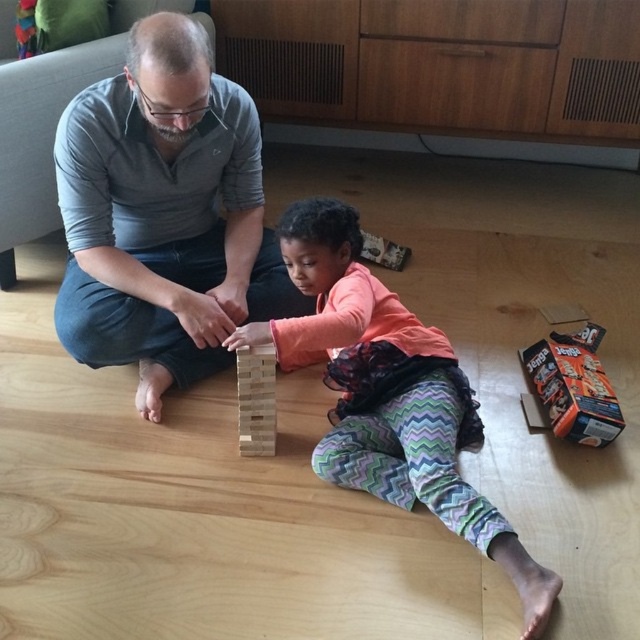
You are a photographer trying to capture a closeup of the orange cardboard box at lower right without including the matte gray shirt at upper left in the frame. Given their sizes, is this possible?

The matte gray shirt at upper left has a larger size compared to orange cardboard box at lower right, so it might be challenging to frame the orange cardboard box at lower right without including the matte gray shirt at upper left due to its larger size.

You are standing at the origin point in the image. Which object is closer to you, the matte gray shirt at upper left or the Jenga tower?

The matte gray shirt at upper left is closer to you because it is located at point (163, 214), which is nearer to the origin compared to the Jenga tower.

You are a photographer trying to capture a candid shot of the Jenga game. You need to position your camera so that the matte gray shirt at upper left and the orange cardboard box at lower right are both clearly visible in the frame. Based on their positions, which object should you focus on first to ensure both are in focus?

The matte gray shirt at upper left is located above the orange cardboard box at lower right. To ensure both are in focus, you should focus on the matte gray shirt at upper left first since it is farther away from the camera, allowing the orange cardboard box at lower right to remain in the depth of field.